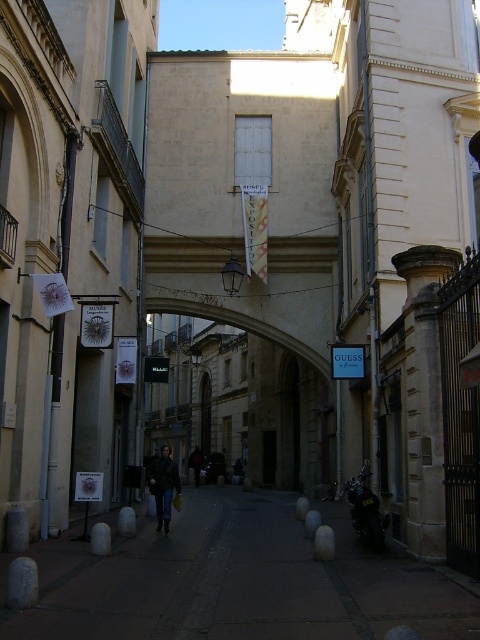
Is dark stone alley at center smaller than dark brown leather jacket at center?

Indeed, dark stone alley at center has a smaller size compared to dark brown leather jacket at center.

Is point (360, 586) closer to viewer compared to point (168, 451)?

That is True.

What do you see at coordinates (237, 580) in the screenshot? The height and width of the screenshot is (640, 480). I see `dark stone alley at center` at bounding box center [237, 580].

I want to click on dark stone alley at center, so click(237, 580).

Which is behind, point (188, 342) or point (195, 484)?

Point (188, 342)

Consider the image. Does beige stone archway at center appear on the right side of dark blue jeans at center?

Yes, beige stone archway at center is to the right of dark blue jeans at center.

The width and height of the screenshot is (480, 640). I want to click on beige stone archway at center, so click(x=240, y=403).

Locate an element on the screen. Image resolution: width=480 pixels, height=640 pixels. beige stone archway at center is located at coordinates 240,403.

Does beige stone archway at center have a lesser height compared to dark brown leather jacket at center?

Incorrect, beige stone archway at center's height does not fall short of dark brown leather jacket at center's.

Does beige stone archway at center appear on the right side of dark brown leather jacket at center?

Indeed, beige stone archway at center is positioned on the right side of dark brown leather jacket at center.

Between point (162, 440) and point (149, 468), which one is positioned in front?

Positioned in front is point (149, 468).

Locate an element on the screen. beige stone archway at center is located at coordinates (240, 403).